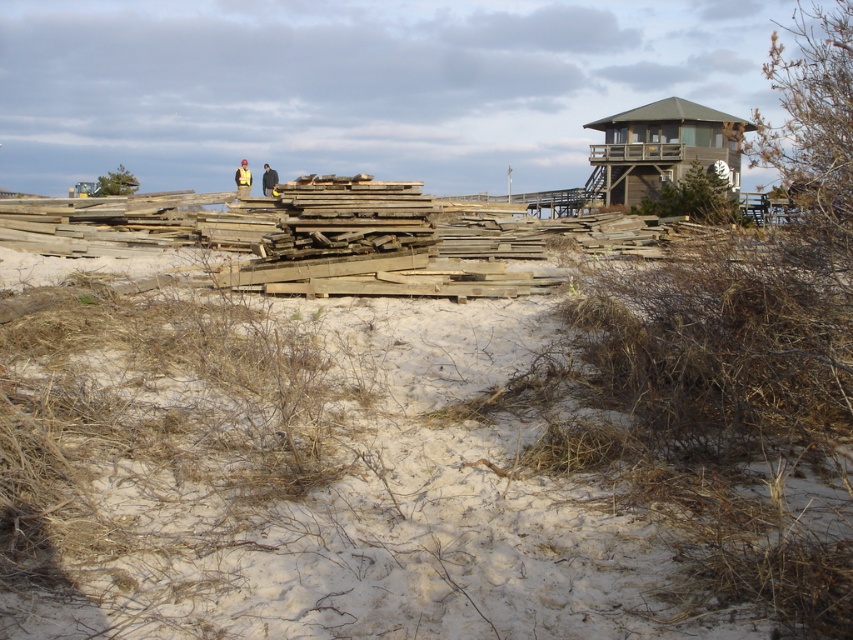
Does yellow hard hat at center have a lesser height compared to yellow reflective vest at center?

Correct, yellow hard hat at center is not as tall as yellow reflective vest at center.

Who is lower down, yellow hard hat at center or yellow reflective vest at center?

Positioned lower is yellow hard hat at center.

Where is `yellow hard hat at center`? yellow hard hat at center is located at coordinates (268, 180).

Is white sandy beach at center wider than yellow reflective vest at center?

No.

Which is behind, point (184, 580) or point (241, 184)?

Point (241, 184)

Where is `white sandy beach at center`? This screenshot has width=853, height=640. white sandy beach at center is located at coordinates (424, 465).

Looking at this image, is white sandy beach at center above yellow hard hat at center?

Incorrect, white sandy beach at center is not positioned above yellow hard hat at center.

This screenshot has width=853, height=640. What do you see at coordinates (424, 465) in the screenshot? I see `white sandy beach at center` at bounding box center [424, 465].

Who is more distant from viewer, [48,332] or [260,186]?

The point [260,186] is more distant.

At what (x,y) coordinates should I click in order to perform the action: click on white sandy beach at center. Please return your answer as a coordinate pair (x, y). The image size is (853, 640). Looking at the image, I should click on (424, 465).